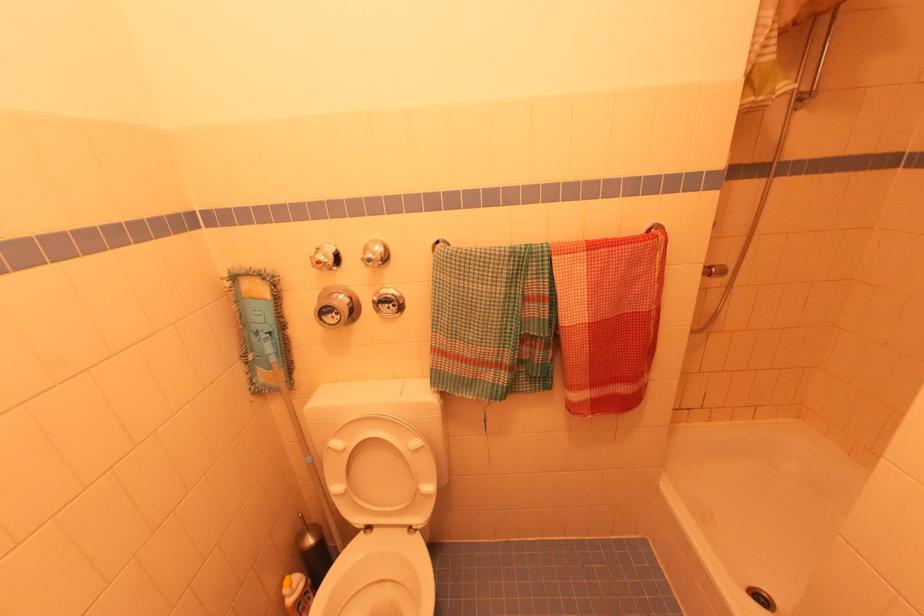
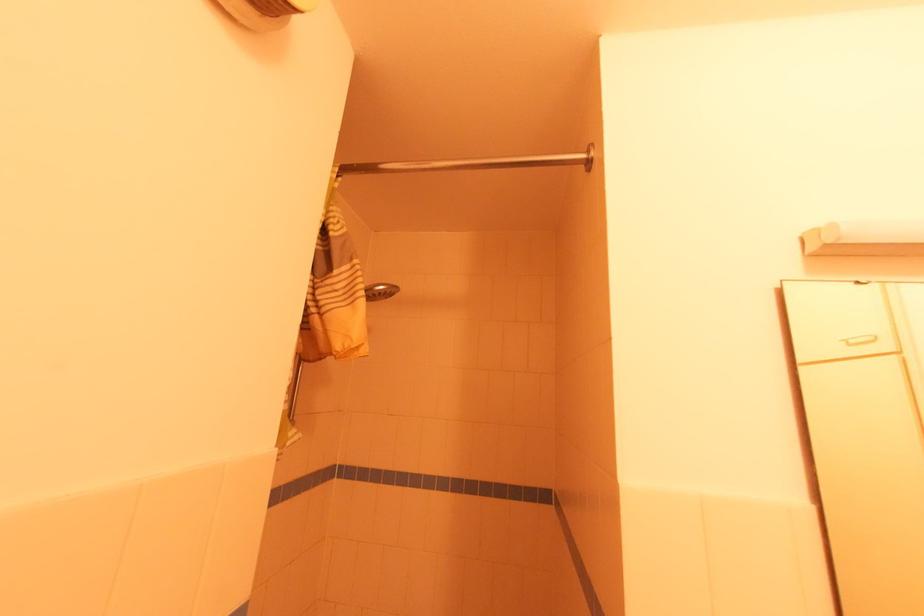
Based on the continuous images, in which direction is the camera rotating?

The camera's rotation is toward right-up.